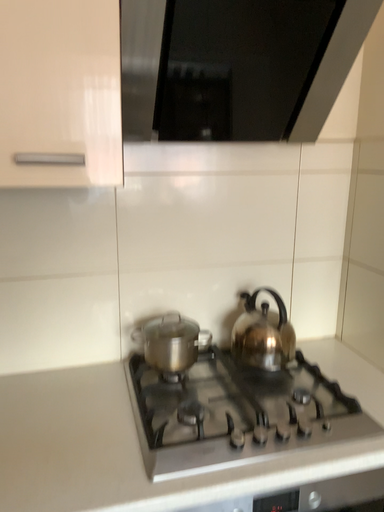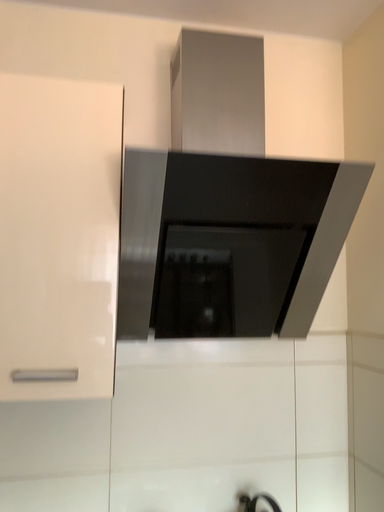
Question: Which way did the camera rotate in the video?

Choices:
 (A) rotated upward
 (B) rotated downward

Answer: (A)